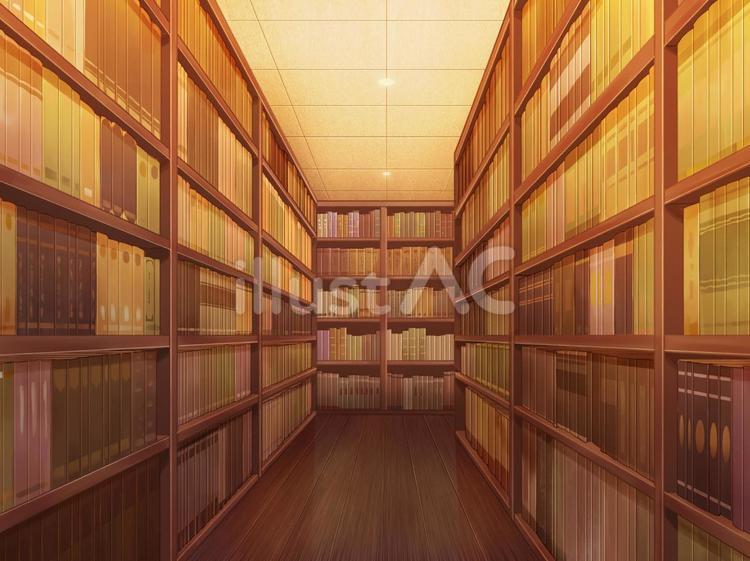
Where is `floor planks`? floor planks is located at coordinates (259, 500), (286, 505), (321, 517), (351, 527), (405, 527), (448, 527), (487, 519).